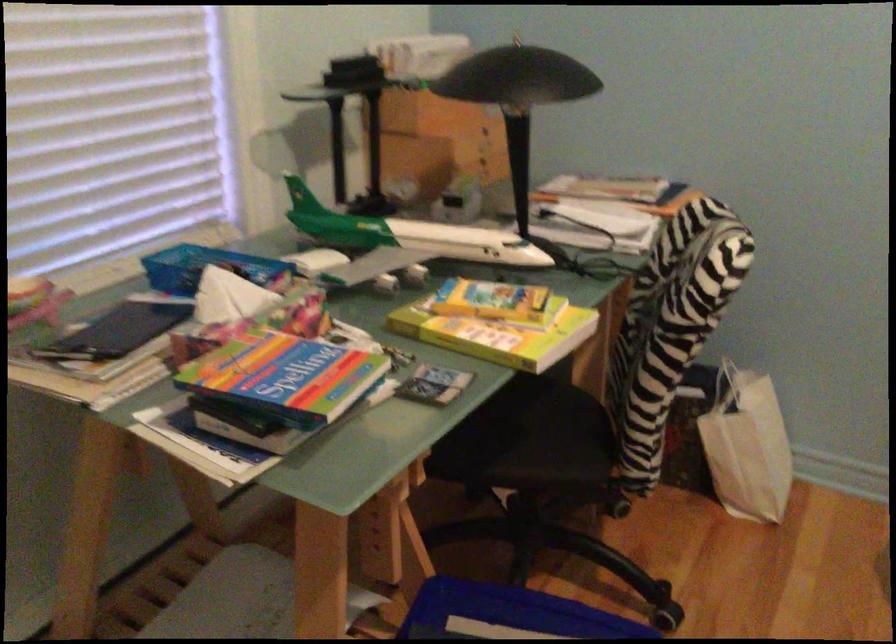
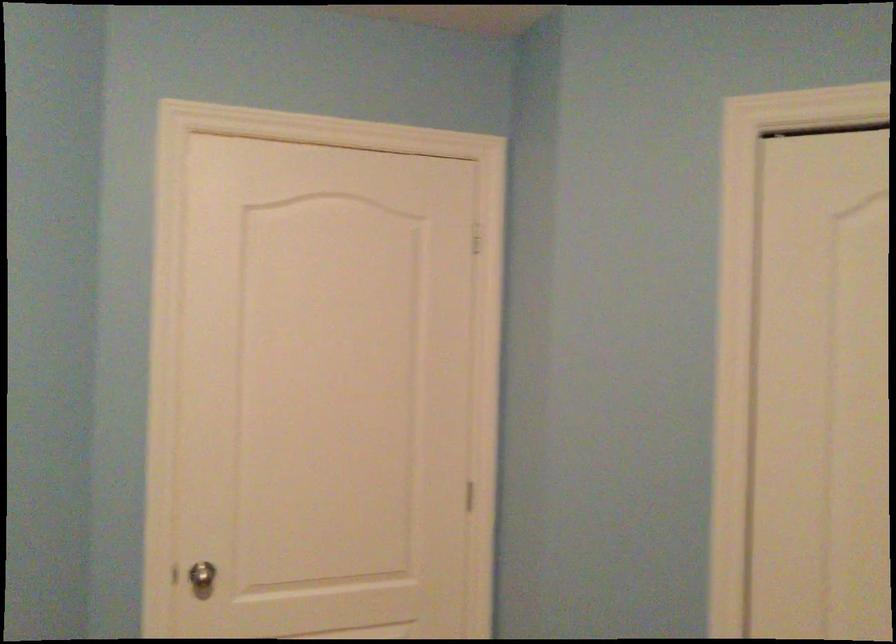
Question: The first image is from the beginning of the video and the second image is from the end. How did the camera likely rotate when shooting the video?

Choices:
 (A) Left
 (B) Right
 (C) Up
 (D) Down

Answer: (B)